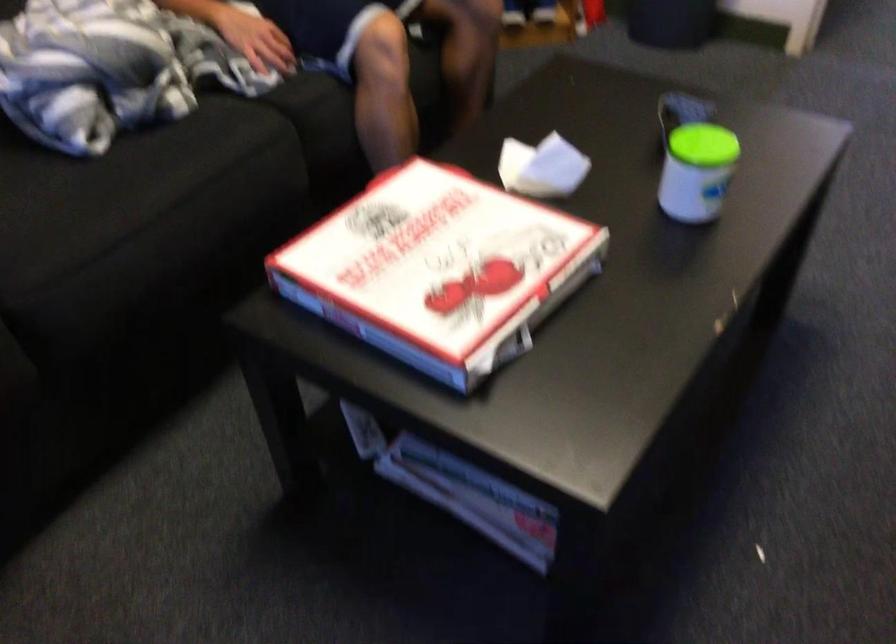
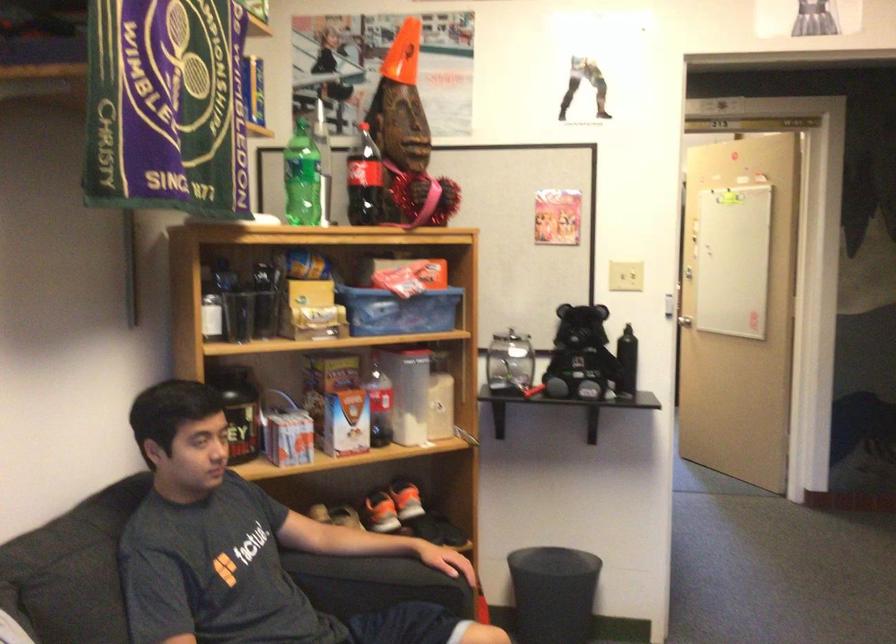
The first image is from the beginning of the video and the second image is from the end. How did the camera likely rotate when shooting the video?

The camera rotated toward right-up.